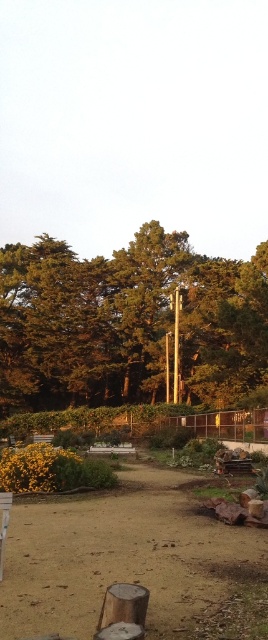
Which is in front, point (101, 365) or point (150, 563)?

Point (150, 563) is more forward.

Is green leafy tree at center thinner than brown sandy dirt at center?

No.

The height and width of the screenshot is (640, 268). I want to click on green leafy tree at center, so click(128, 323).